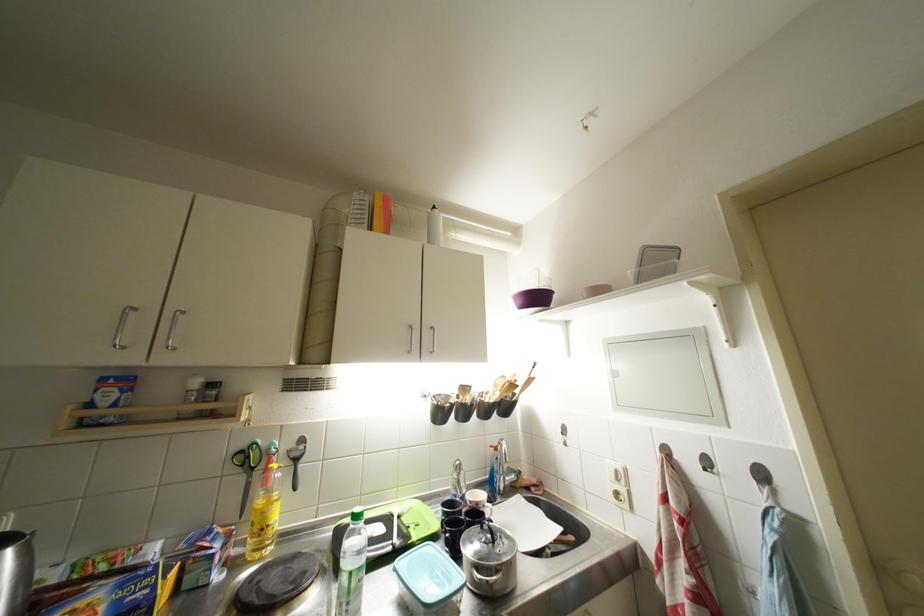
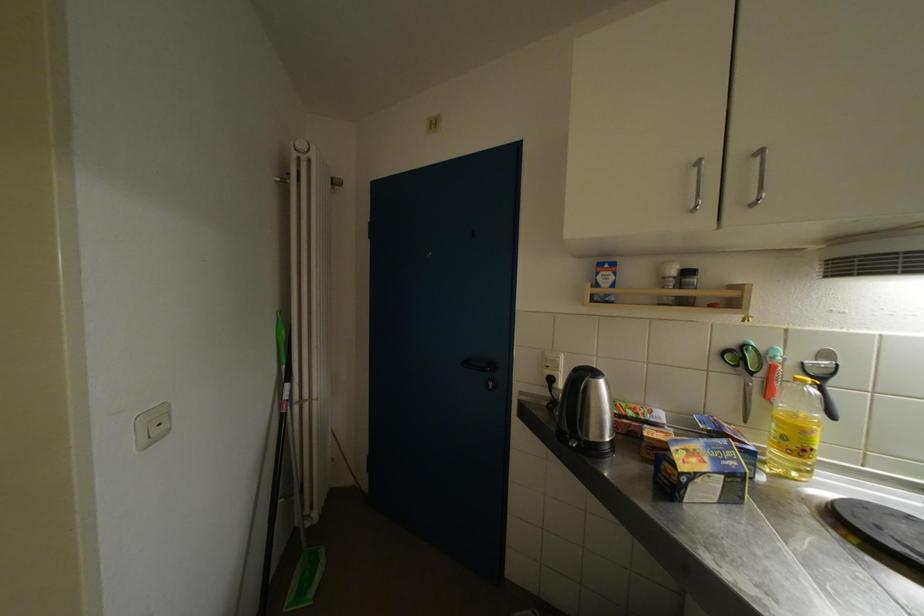
Question: The images are taken continuously from a first-person perspective. In which direction is your viewpoint rotating?

Choices:
 (A) Left
 (B) Right
 (C) Up
 (D) Down

Answer: (A)